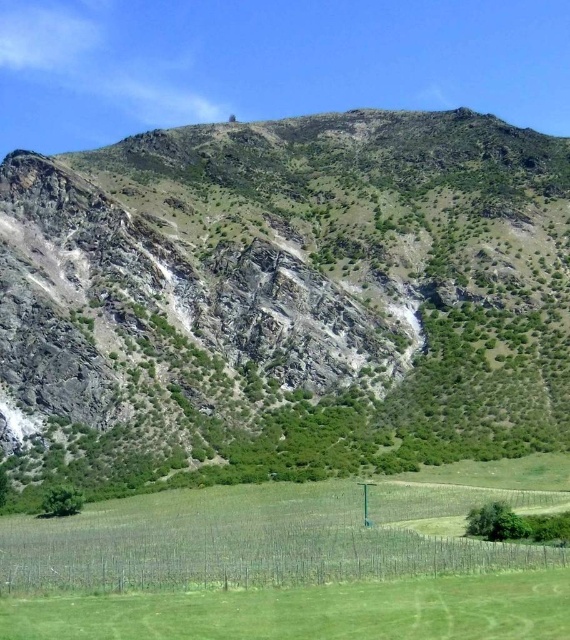
Does point (11, 433) come in front of point (79, 588)?

That is False.

Is green rocky mountain at upper center positioned at the back of green grassy field at lower center?

Yes, it is.

Is point (99, 422) positioned in front of point (247, 492)?

That is False.

Find the location of a particular element. Image resolution: width=570 pixels, height=640 pixels. green rocky mountain at upper center is located at coordinates (286, 298).